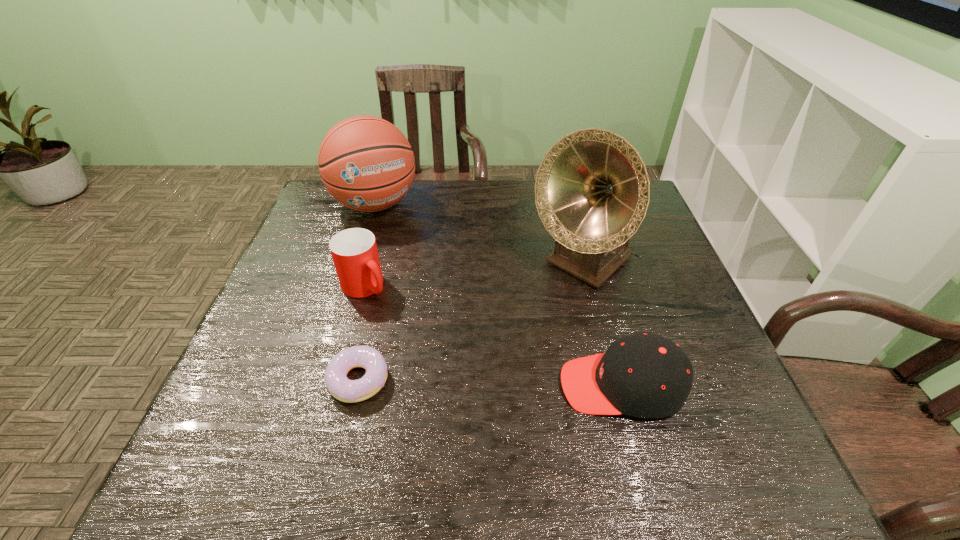
Locate an element on the screen. free location that satisfies the following two spatial constraints: 1. on the back side of the tallest object; 2. on the left side of the cup is located at coordinates (372, 263).

The image size is (960, 540). What are the coordinates of `vacant space that satisfies the following two spatial constraints: 1. on the back side of the tallest object; 2. on the right side of the cup` in the screenshot? It's located at (372, 263).

You are a GUI agent. You are given a task and a screenshot of the screen. Output one action in this format:
    pyautogui.click(x=<x>, y=<y>)
    Task: Click on the free location that satisfies the following two spatial constraints: 1. on the front side of the cap; 2. on the front-facing side of the doughnut
    The width and height of the screenshot is (960, 540).
    Given the screenshot: What is the action you would take?
    pyautogui.click(x=357, y=386)

Where is `blank area in the image that satisfies the following two spatial constraints: 1. on the front side of the farthest object; 2. on the left side of the cup`? blank area in the image that satisfies the following two spatial constraints: 1. on the front side of the farthest object; 2. on the left side of the cup is located at coordinates (349, 286).